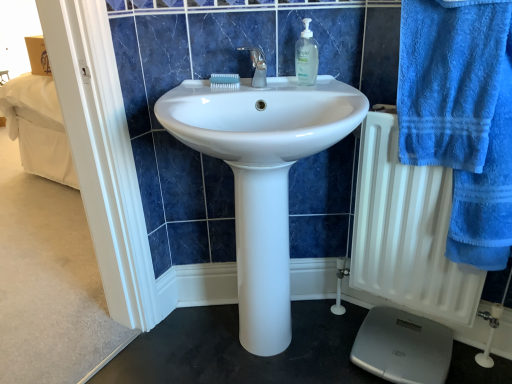
Locate an element on the screen. This screenshot has width=512, height=384. vacant region to the left of gray plastic scale at lower right is located at coordinates (324, 344).